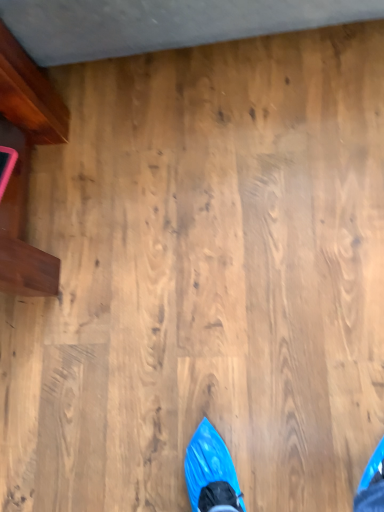
Locate an element on the screen. This screenshot has height=512, width=384. vacant area that is situated to the right of wooden desk at left is located at coordinates (137, 147).